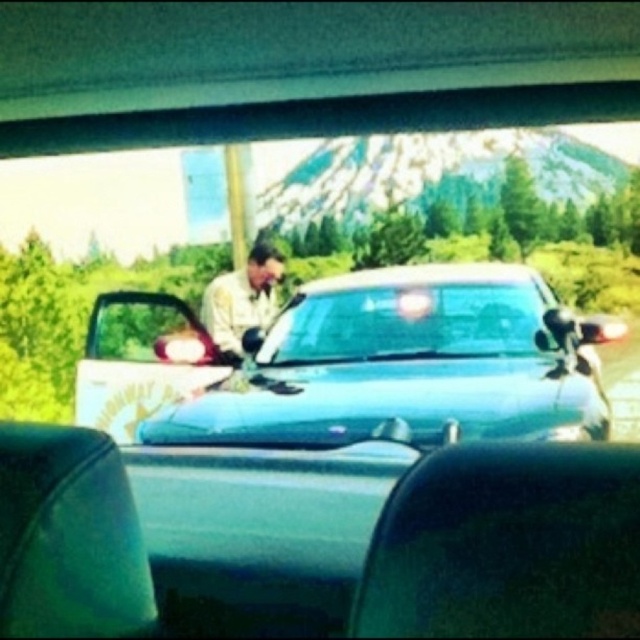
Question: Can you confirm if matte khaki uniform at center is wider than transparent glass windshield at center?

Choices:
 (A) no
 (B) yes

Answer: (B)

Question: Which point appears closest to the camera in this image?

Choices:
 (A) (400, 269)
 (B) (308, 301)
 (C) (218, 288)

Answer: (B)

Question: Which of the following is the farthest from the observer?

Choices:
 (A) (216, 285)
 (B) (582, 401)
 (C) (518, 349)

Answer: (A)

Question: Observing the image, what is the correct spatial positioning of transparent glass windshield at center in reference to light beige uniform at center?

Choices:
 (A) right
 (B) left

Answer: (A)

Question: Which object appears farthest from the camera in this image?

Choices:
 (A) light beige uniform at center
 (B) matte khaki uniform at center
 (C) transparent glass windshield at center

Answer: (A)

Question: Is matte khaki uniform at center above light beige uniform at center?

Choices:
 (A) yes
 (B) no

Answer: (B)